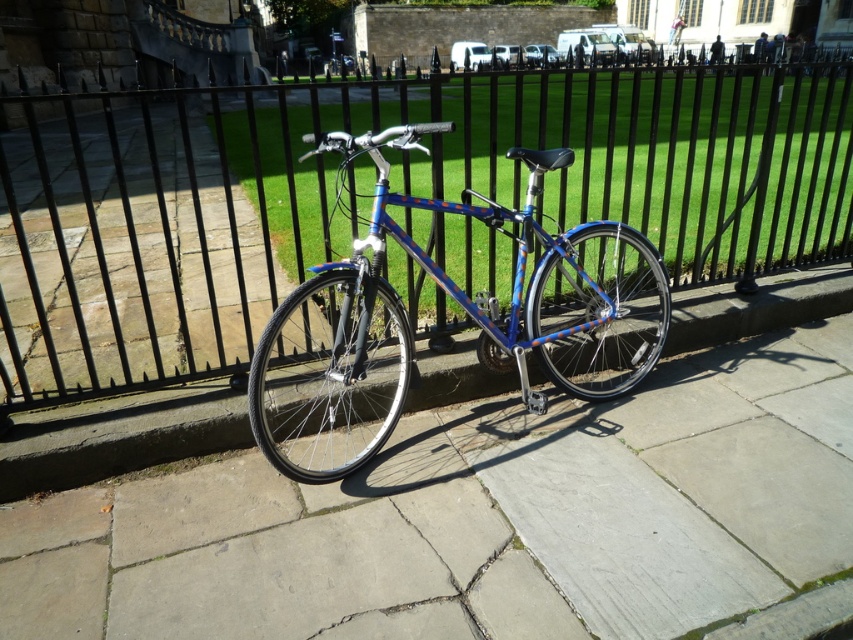
Question: Which point is farther to the camera?

Choices:
 (A) (328, 416)
 (B) (636, 212)

Answer: (B)

Question: Which object is closer to the camera taking this photo?

Choices:
 (A) gray concrete pavement at center
 (B) blue metallic bicycle at center

Answer: (A)

Question: Does gray concrete pavement at center appear under blue metallic bicycle at center?

Choices:
 (A) no
 (B) yes

Answer: (B)

Question: Is gray concrete pavement at center bigger than black metal fence at center?

Choices:
 (A) yes
 (B) no

Answer: (B)

Question: Is gray concrete pavement at center bigger than black metal fence at center?

Choices:
 (A) no
 (B) yes

Answer: (A)

Question: Which object appears closest to the camera in this image?

Choices:
 (A) gray concrete pavement at center
 (B) black metal fence at center

Answer: (A)